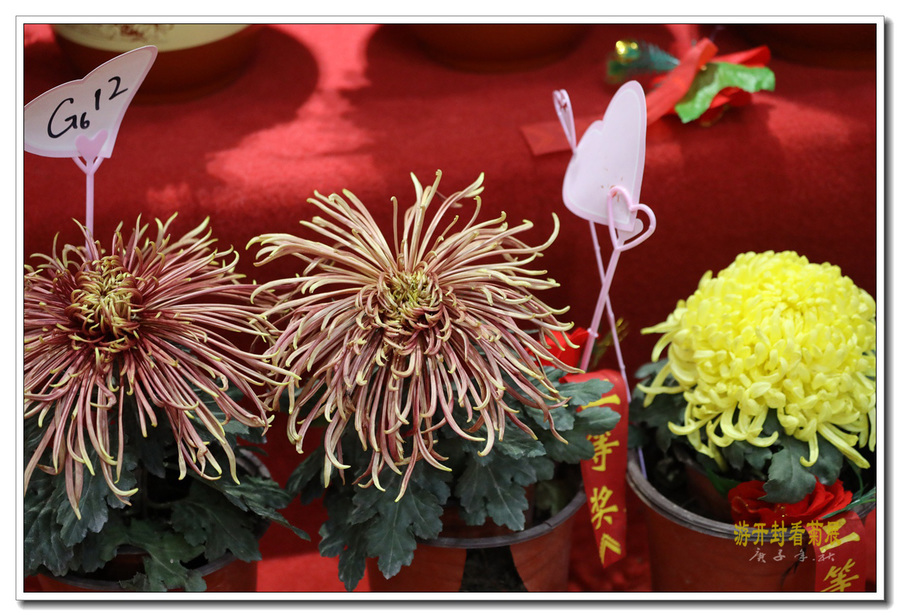
Identify the location of red cloth. (312, 122), (302, 565).